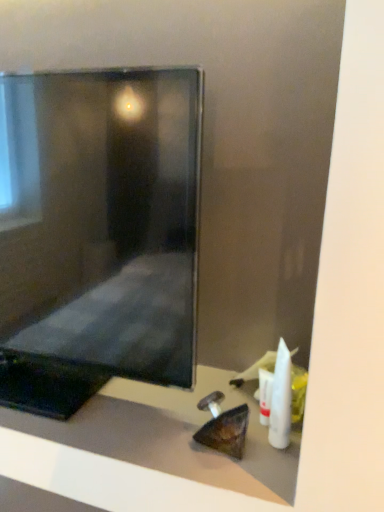
I want to click on vacant space behind white plastic toothbrush at lower right, which is the second toiletry in back-to-front order, so click(x=230, y=394).